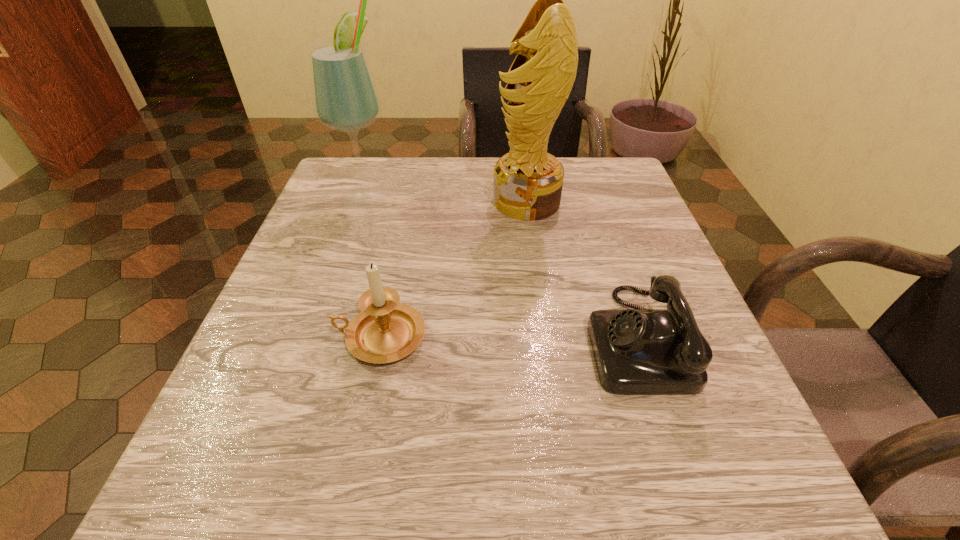
Find the location of a particular element. The image size is (960, 540). alcohol is located at coordinates (345, 98).

In order to click on award in this screenshot , I will do click(528, 181).

This screenshot has width=960, height=540. Identify the location of candle holder. (385, 331).

Where is `the shortest object`? This screenshot has height=540, width=960. the shortest object is located at coordinates (637, 351).

You are a GUI agent. You are given a task and a screenshot of the screen. Output one action in this format:
    pyautogui.click(x=<x>, y=<y>)
    Task: Click on the vacant space located 0.210m on the right of the alcohol
    Image resolution: width=960 pixels, height=540 pixels.
    Given the screenshot: What is the action you would take?
    pyautogui.click(x=490, y=193)

Locate an element on the screen. The height and width of the screenshot is (540, 960). free space located on the front-facing side of the award is located at coordinates (470, 201).

The width and height of the screenshot is (960, 540). In order to click on vacant region located on the front-facing side of the award in this screenshot , I will do `click(440, 201)`.

Locate an element on the screen. The width and height of the screenshot is (960, 540). vacant space located on the front-facing side of the award is located at coordinates 453,201.

Where is `free space located 0.100m with a handle on the side of the candle holder`? The width and height of the screenshot is (960, 540). free space located 0.100m with a handle on the side of the candle holder is located at coordinates (271, 338).

Identify the location of free space located 0.050m with a handle on the side of the candle holder. click(x=301, y=338).